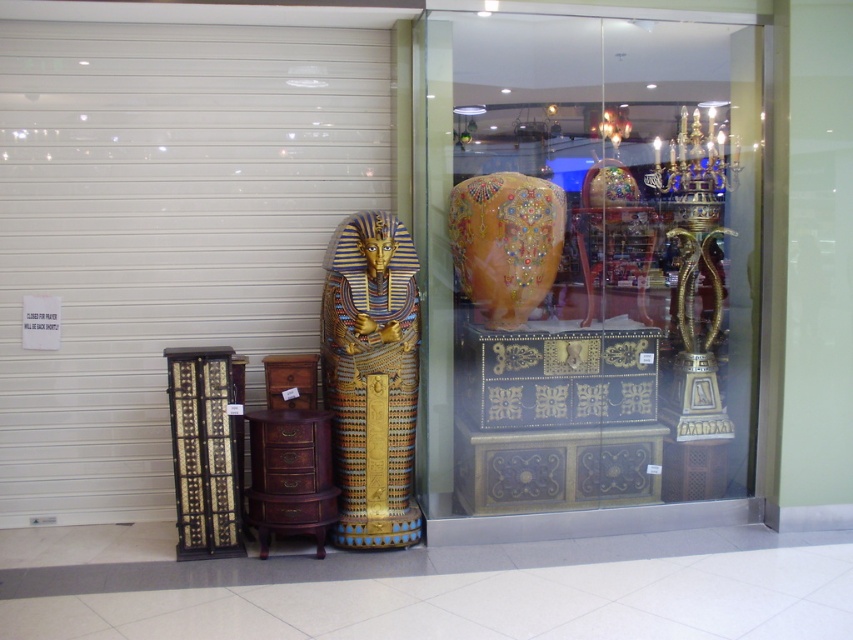
The image size is (853, 640). What do you see at coordinates (370, 378) in the screenshot?
I see `gold metallic sarcophagus at center` at bounding box center [370, 378].

Which is more to the right, gold metallic sarcophagus at center or golden glossy vase at center?

From the viewer's perspective, golden glossy vase at center appears more on the right side.

Locate an element on the screen. The image size is (853, 640). gold metallic sarcophagus at center is located at coordinates (370, 378).

Where is `gold metallic sarcophagus at center`? The height and width of the screenshot is (640, 853). gold metallic sarcophagus at center is located at coordinates (370, 378).

Is point (583, 422) closer to viewer compared to point (561, 212)?

No, it is behind (561, 212).

Does matte gold vase at center appear under golden glossy vase at center?

Correct, matte gold vase at center is located below golden glossy vase at center.

Does point (430, 305) come farther from viewer compared to point (498, 241)?

Yes, point (430, 305) is behind point (498, 241).

Where is `matte gold vase at center`? The width and height of the screenshot is (853, 640). matte gold vase at center is located at coordinates (589, 275).

Does point (711, 232) lie behind point (364, 264)?

Yes, it is.

Is point (746, 468) less distant than point (381, 237)?

No, (746, 468) is further to viewer.

Locate an element on the screen. The height and width of the screenshot is (640, 853). matte gold vase at center is located at coordinates (589, 275).